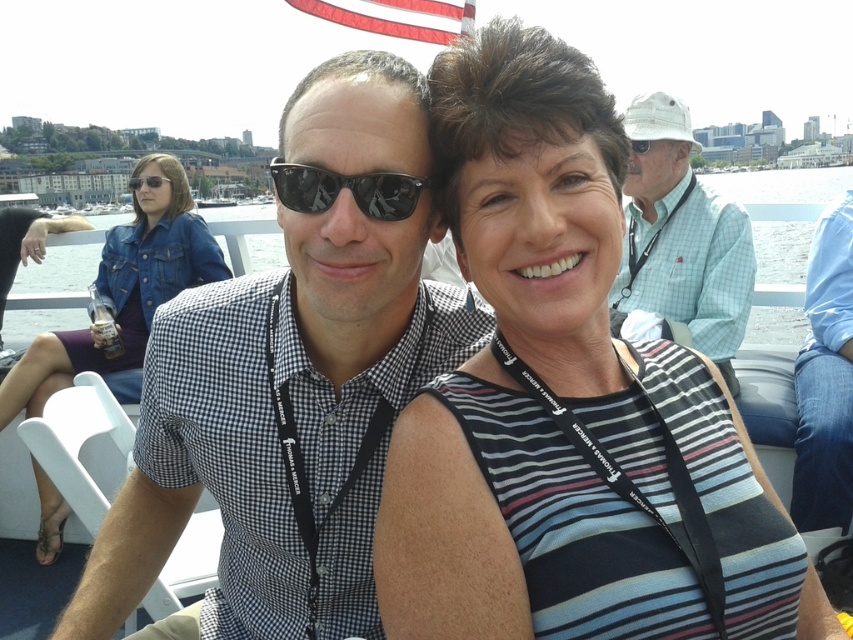
You are standing at the origin point of the image coordinate system. There is a white cotton hat at upper right represented by point (x=682, y=237). Can you tell me the direction of the white cotton hat at upper right relative to the origin?

The white cotton hat at upper right is located at coordinates (x=682, y=237), which means it is positioned to the upper right relative to the origin point.

Based on the photo, you are a photographer trying to capture a closeup of the checkered fabric shirt at center. According to the coordinates provided, where should you focus your camera lens to ensure the shirt is in the center of the frame?

The checkered fabric shirt at center is located at coordinates point (x=279, y=428), so you should focus your camera lens at that point to center the shirt in the frame.

You are a photographer taking a picture of the waterfront event. You notice the striped fabric dress at center and the white cotton hat at upper right. Which object is positioned higher in the image?

The white cotton hat at upper right is positioned higher in the image than the striped fabric dress at center, as the striped fabric dress at center is located below the white cotton hat at upper right.